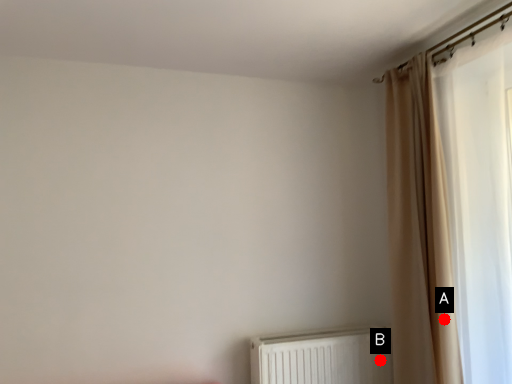
Question: Two points are circled on the image, labeled by A and B beside each circle. Which point appears closest to the camera in this image?

Choices:
 (A) A is closer
 (B) B is closer

Answer: (A)